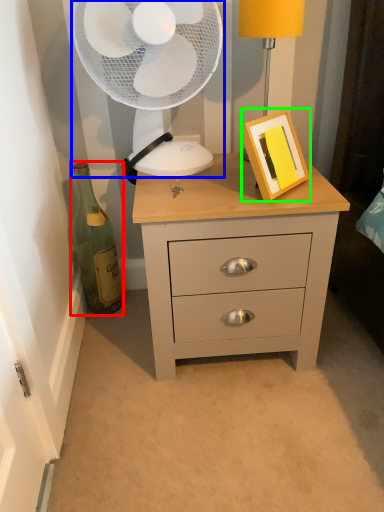
Question: Which object is positioned closest to bottle (highlighted by a red box)? Select from mechanical fan (highlighted by a blue box) and picture frame (highlighted by a green box).

Choices:
 (A) mechanical fan
 (B) picture frame

Answer: (A)